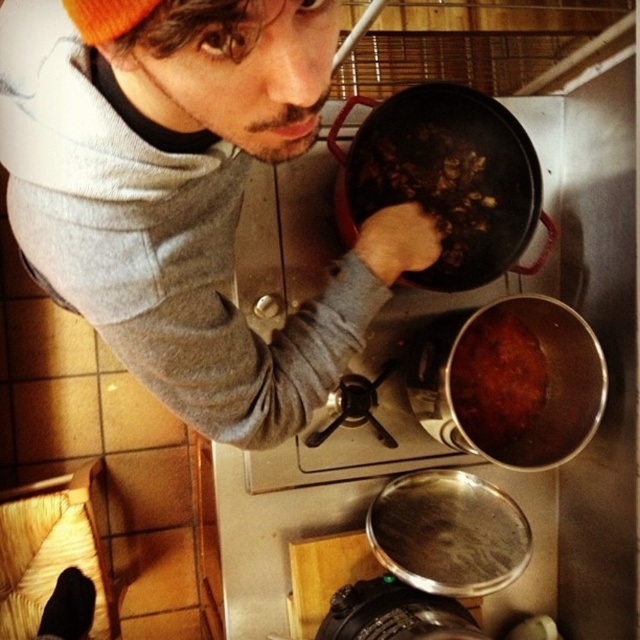
Looking at this image, you are a chef who needs to determine which item is larger between the matte gray sweater at upper left and the brown matte pot at lower right. Based on the scene, which one is larger?

The matte gray sweater at upper left is bigger than the brown matte pot at lower right according to the description.

You need to hang a coat hanger on the wall next to the matte gray sweater at upper left and the matte black frying pan at center. Which object should you place the hanger closer to to ensure it doesn,t fall off?

The matte gray sweater at upper left might be wider than matte black frying pan at center, so placing the hanger closer to the matte gray sweater at upper left would provide better support to prevent it from falling off.

From the picture: You are a chef preparing to cook a meal and need to store the matte gray sweater at upper left and the matte black frying pan at center in a drawer. The drawer has a height capacity of 10 inches. Can both items fit vertically in the drawer without overlapping?

The matte gray sweater at upper left has a larger size compared to matte black frying pan at center. Therefore, if the sweater is taller than the frying pan and the frying pan can fit within the 10 inches, the sweater might exceed the height limit. However, without exact measurements, it is uncertain. Please check the individual heights of both items.